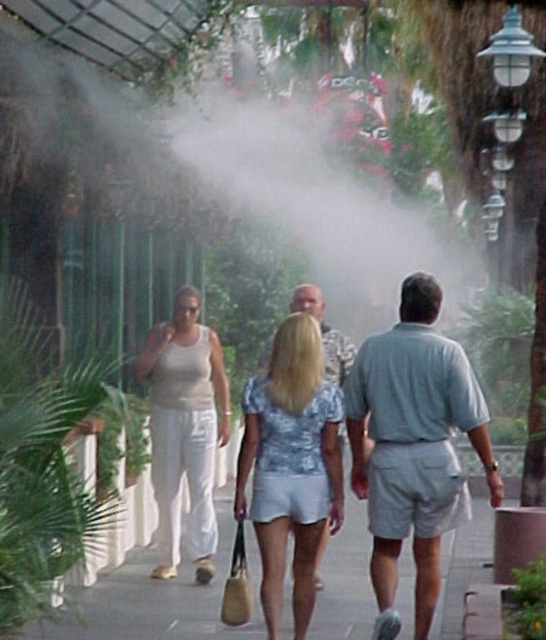
Question: Considering the real-world distances, which object is closest to the gray concrete pavement at center?

Choices:
 (A) light blue cotton shorts at center
 (B) matte white pants at left
 (C) green leafy palm tree at left

Answer: (B)

Question: Which of the following is the farthest from the observer?

Choices:
 (A) green leafy palm tree at left
 (B) gray concrete pavement at center

Answer: (B)

Question: Which point appears closest to the camera in this image?

Choices:
 (A) (278, 538)
 (B) (424, 620)

Answer: (B)

Question: Is gray concrete pavement at center further to the viewer compared to green leafy palm tree at left?

Choices:
 (A) yes
 (B) no

Answer: (A)

Question: Is light blue cotton shorts at center positioned behind green leafy palm tree at left?

Choices:
 (A) yes
 (B) no

Answer: (A)

Question: Is light blue cotton shorts at center below gray cotton shorts at center?

Choices:
 (A) no
 (B) yes

Answer: (A)